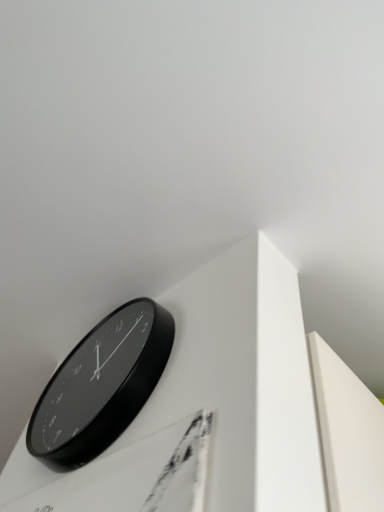
Locate an element on the screen. The width and height of the screenshot is (384, 512). black matte wall clock at lower left is located at coordinates (101, 385).

Image resolution: width=384 pixels, height=512 pixels. What do you see at coordinates (101, 385) in the screenshot? I see `black matte wall clock at lower left` at bounding box center [101, 385].

The image size is (384, 512). Find the location of `black matte wall clock at lower left`. black matte wall clock at lower left is located at coordinates (101, 385).